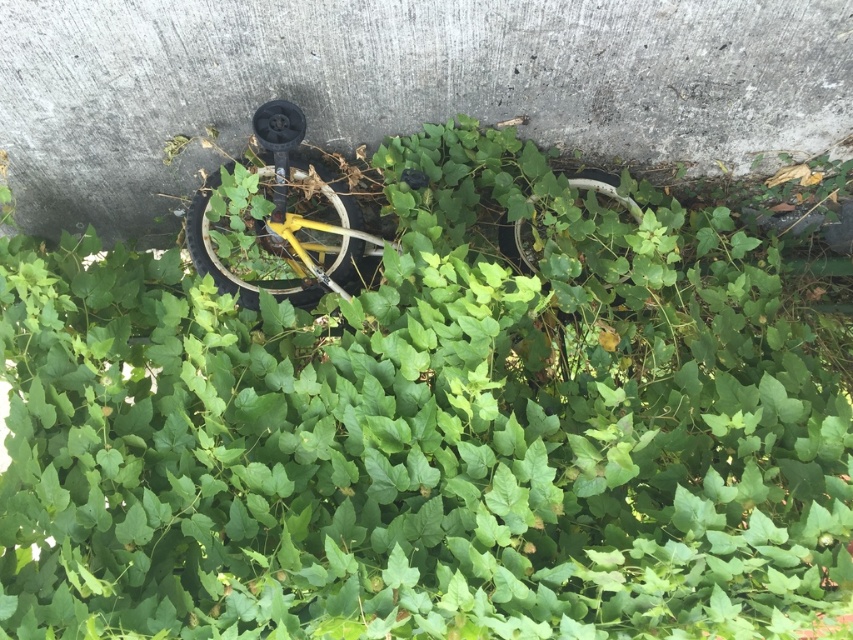
Question: Is gray concrete at center bigger than yellow matte bicycle wheel at center?

Choices:
 (A) yes
 (B) no

Answer: (A)

Question: Which of the following is the farthest from the observer?

Choices:
 (A) yellow matte bicycle wheel at center
 (B) gray concrete at center

Answer: (A)

Question: Does gray concrete at center have a larger size compared to yellow matte bicycle wheel at center?

Choices:
 (A) no
 (B) yes

Answer: (B)

Question: In this image, where is gray concrete at center located relative to yellow matte bicycle wheel at center?

Choices:
 (A) right
 (B) left

Answer: (A)

Question: Which of the following is the closest to the observer?

Choices:
 (A) yellow matte bicycle wheel at center
 (B) gray concrete at center

Answer: (B)